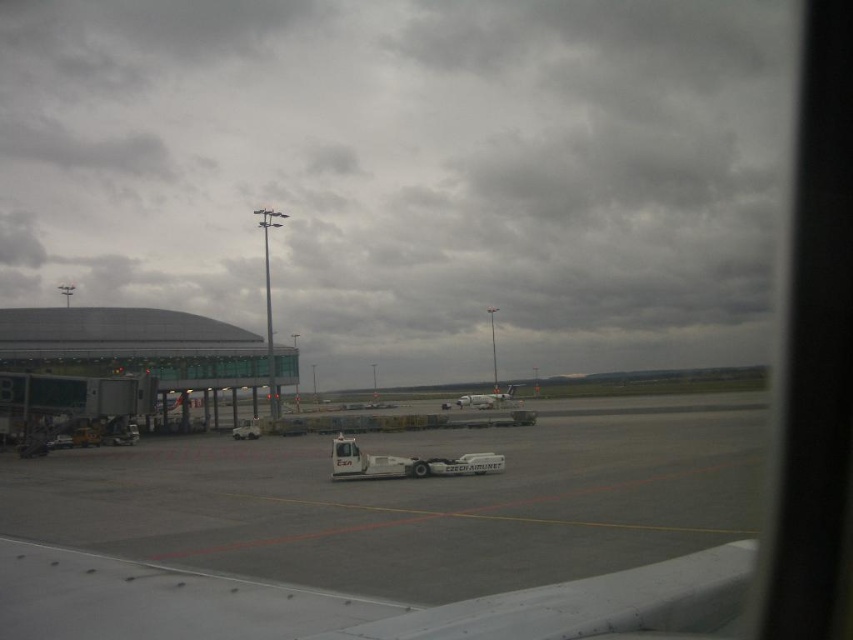
Question: Among these objects, which one is nearest to the camera?

Choices:
 (A) white matte airplane at center
 (B) transparent glass terminal at left
 (C) white rubber tarmac at center

Answer: (C)

Question: Is transparent glass terminal at left to the left of white matte airplane at center from the viewer's perspective?

Choices:
 (A) yes
 (B) no

Answer: (A)

Question: Which point is farther to the camera?

Choices:
 (A) (463, 394)
 (B) (299, 612)

Answer: (A)

Question: Estimate the real-world distances between objects in this image. Which object is closer to the white matte airplane at center?

Choices:
 (A) transparent glass terminal at left
 (B) white rubber tarmac at center

Answer: (A)

Question: Can you confirm if transparent glass terminal at left is bigger than white matte airplane at center?

Choices:
 (A) no
 (B) yes

Answer: (B)

Question: Is white rubber tarmac at center thinner than transparent glass terminal at left?

Choices:
 (A) no
 (B) yes

Answer: (A)